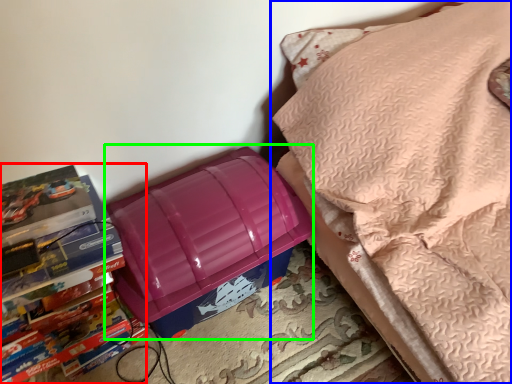
Question: Which is nearer to the book (highlighted by a red box)? furniture (highlighted by a blue box) or lunch box (highlighted by a green box).

Choices:
 (A) furniture
 (B) lunch box

Answer: (B)